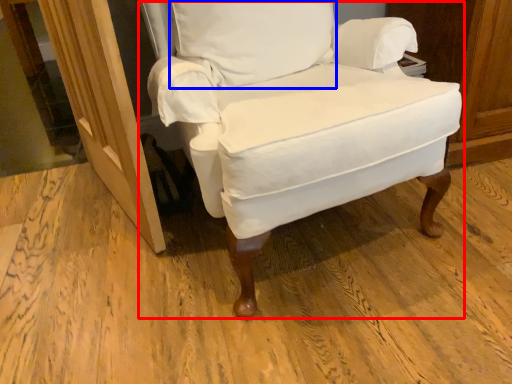
Question: Which object appears farthest to the camera in this image, chair (highlighted by a red box) or pillow (highlighted by a blue box)?

Choices:
 (A) chair
 (B) pillow

Answer: (B)